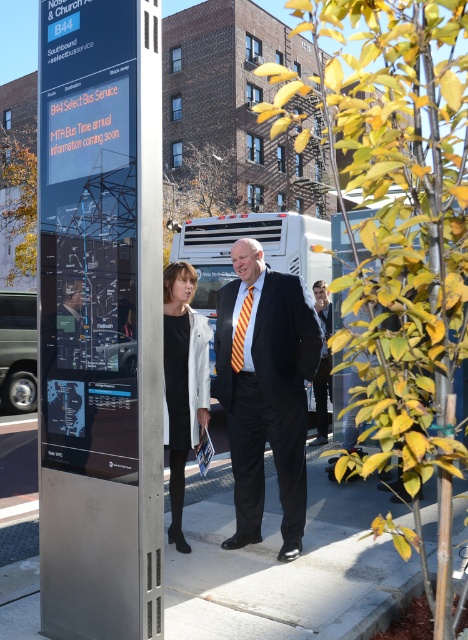
Can you confirm if white matte coat at center is positioned above yellow striped tie at center?

Actually, white matte coat at center is below yellow striped tie at center.

What do you see at coordinates (182, 381) in the screenshot? The height and width of the screenshot is (640, 468). I see `white matte coat at center` at bounding box center [182, 381].

Where is `white matte coat at center`? white matte coat at center is located at coordinates (182, 381).

Looking at this image, measure the distance between matte black suit at center and dark gray suit at center.

matte black suit at center and dark gray suit at center are 3.54 meters apart.

Which is in front, point (297, 276) or point (323, 308)?

Point (297, 276)

Between point (272, 433) and point (323, 408), which one is positioned in front?

Point (272, 433)

At what (x,y) coordinates should I click in order to perform the action: click on matte black suit at center. Please return your answer as a coordinate pair (x, y). This screenshot has width=468, height=640. Looking at the image, I should click on (265, 388).

Is white concrete pavement at center above matte black suit at center?

No, white concrete pavement at center is not above matte black suit at center.

Is white concrete pavement at center positioned behind matte black suit at center?

No, it is not.

Where is `white concrete pavement at center`? The image size is (468, 640). white concrete pavement at center is located at coordinates (286, 570).

Locate an element on the screen. The image size is (468, 640). white concrete pavement at center is located at coordinates (286, 570).